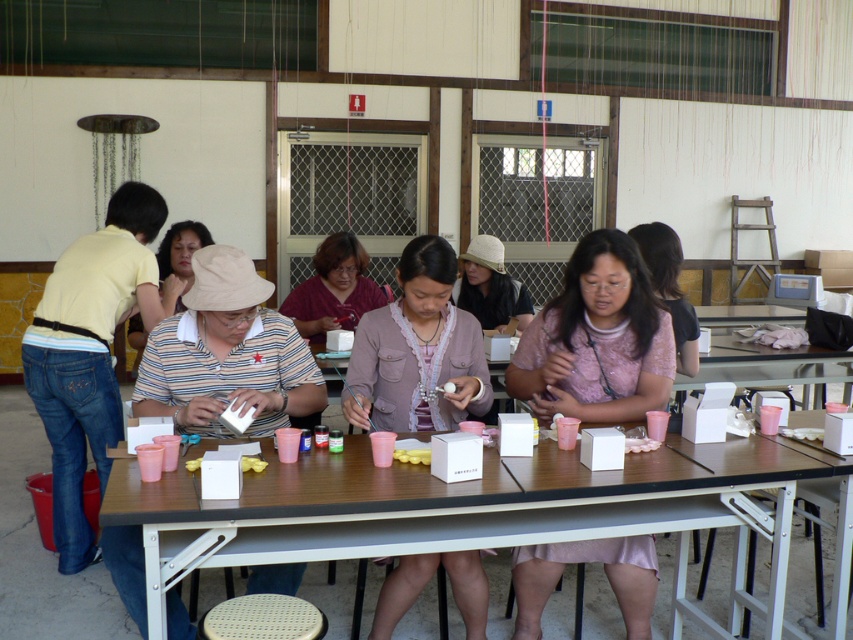
You are a photographer trying to capture a closeup of the white woven stool at lower center without including the pink fabric shirt at center in the frame. Given their positions, can you position yourself in a way that achieves this?

The pink fabric shirt at center is on the right side of the white woven stool at lower center, so if you position yourself to the left side of the stool, you can frame the shot to exclude the shirt.